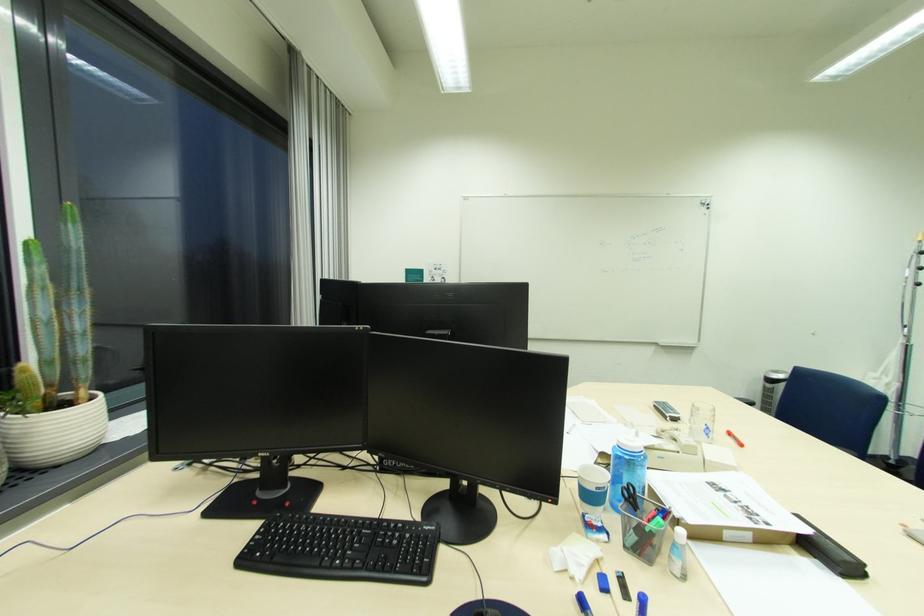
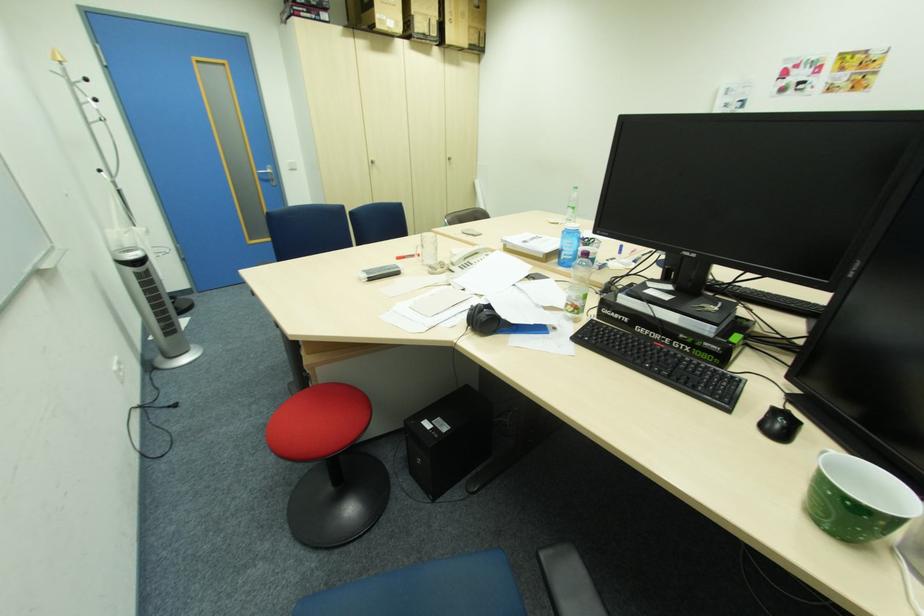
Question: I am providing you with two images of the same scene from different viewpoints. Which of the following objects are not visible in image2?

Choices:
 (A) black chair armrest
 (B) round patterned box
 (C) silver door handle
 (D) telephone handset

Answer: (D)